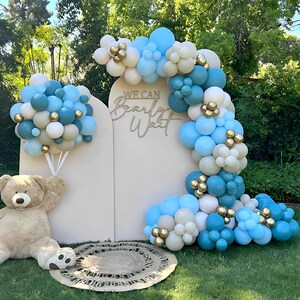
Identify the location of small rug. The height and width of the screenshot is (300, 300). (108, 262).